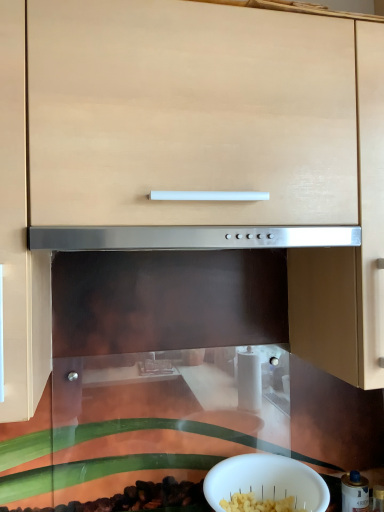
Image resolution: width=384 pixels, height=512 pixels. Describe the element at coordinates (266, 481) in the screenshot. I see `white matte bowl at lower center` at that location.

Measure the distance between point (293, 464) and camera.

The depth of point (293, 464) is 1.02 meters.

Find the location of a particular element. Image resolution: width=384 pixels, height=512 pixels. white matte bowl at lower center is located at coordinates (266, 481).

Locate an element on the screen. metallic silver canister at lower right is located at coordinates (354, 492).

Image resolution: width=384 pixels, height=512 pixels. Describe the element at coordinates (354, 492) in the screenshot. I see `metallic silver canister at lower right` at that location.

Locate an element on the screen. The width and height of the screenshot is (384, 512). white matte bowl at lower center is located at coordinates (266, 481).

Which is more to the right, white matte bowl at lower center or metallic silver canister at lower right?

metallic silver canister at lower right.

Considering their positions, is white matte bowl at lower center located in front of or behind metallic silver canister at lower right?

Clearly, white matte bowl at lower center is in front of metallic silver canister at lower right.

Considering the positions of point (323, 503) and point (367, 502), is point (323, 503) closer or farther from the camera than point (367, 502)?

Point (323, 503) appears to be closer to the viewer than point (367, 502).

From the image's perspective, between white matte bowl at lower center and metallic silver canister at lower right, which one is located above?

white matte bowl at lower center appears higher in the image.

Looking at this image, from a real-world perspective, does white matte bowl at lower center sit lower than metallic silver canister at lower right?

Actually, white matte bowl at lower center is physically above metallic silver canister at lower right in the real world.

In terms of width, does white matte bowl at lower center look wider or thinner when compared to metallic silver canister at lower right?

In the image, white matte bowl at lower center appears to be wider than metallic silver canister at lower right.

Who is shorter, white matte bowl at lower center or metallic silver canister at lower right?

white matte bowl at lower center.

Is white matte bowl at lower center smaller than metallic silver canister at lower right?

Actually, white matte bowl at lower center might be larger than metallic silver canister at lower right.

Is white matte bowl at lower center positioned beyond the bounds of metallic silver canister at lower right?

That's correct, white matte bowl at lower center is outside of metallic silver canister at lower right.

Is white matte bowl at lower center next to metallic silver canister at lower right and touching it?

No, white matte bowl at lower center is not touching metallic silver canister at lower right.

Is white matte bowl at lower center looking in the opposite direction of metallic silver canister at lower right?

No, white matte bowl at lower center's orientation is not away from metallic silver canister at lower right.

How far apart are white matte bowl at lower center and metallic silver canister at lower right?

white matte bowl at lower center and metallic silver canister at lower right are 9.24 inches apart.

This screenshot has width=384, height=512. Find the location of `appliance located underneath the white matte bowl at lower center (from a real-world perspective)`. appliance located underneath the white matte bowl at lower center (from a real-world perspective) is located at coordinates (354, 492).

Between metallic silver canister at lower right and white matte bowl at lower center, which one appears on the left side from the viewer's perspective?

white matte bowl at lower center is more to the left.

Is metallic silver canister at lower right in front of white matte bowl at lower center?

That is False.

Does point (345, 490) come behind point (270, 461)?

Yes, it is behind point (270, 461).

From the image's perspective, does metallic silver canister at lower right appear higher than white matte bowl at lower center?

No, from the image's perspective, metallic silver canister at lower right is not on top of white matte bowl at lower center.

From a real-world perspective, between metallic silver canister at lower right and white matte bowl at lower center, who is vertically lower?

metallic silver canister at lower right, from a real-world perspective.

Is metallic silver canister at lower right wider than white matte bowl at lower center?

Incorrect, the width of metallic silver canister at lower right does not surpass that of white matte bowl at lower center.

Does metallic silver canister at lower right have a greater height compared to white matte bowl at lower center?

Yes, metallic silver canister at lower right is taller than white matte bowl at lower center.

Is metallic silver canister at lower right smaller than white matte bowl at lower center?

Yes.

Would you say metallic silver canister at lower right is inside or outside white matte bowl at lower center?

A: The correct answer is: outside.

Looking at this image, is metallic silver canister at lower right placed right next to white matte bowl at lower center?

No, metallic silver canister at lower right is not making contact with white matte bowl at lower center.

Looking at this image, is metallic silver canister at lower right oriented towards white matte bowl at lower center?

No, metallic silver canister at lower right does not turn towards white matte bowl at lower center.

From the picture: How different are the orientations of metallic silver canister at lower right and white matte bowl at lower center in degrees?

They differ by 0.000204 degrees in their facing directions.

How far apart are metallic silver canister at lower right and white matte bowl at lower center?

metallic silver canister at lower right is 9.24 inches from white matte bowl at lower center.

Locate an element on the screen. The height and width of the screenshot is (512, 384). bowl above the metallic silver canister at lower right (from the image's perspective) is located at coordinates (266, 481).

This screenshot has width=384, height=512. I want to click on bowl that appears above the metallic silver canister at lower right (from a real-world perspective), so click(266, 481).

The width and height of the screenshot is (384, 512). Identify the location of appliance on the right side of white matte bowl at lower center. coord(354,492).